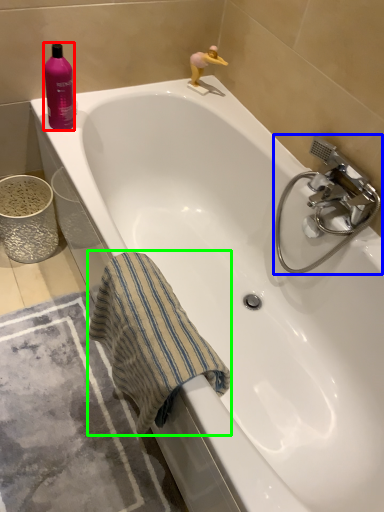
Question: Considering the real-world distances, which object is farthest from cleaning product (highlighted by a red box)? tap (highlighted by a blue box) or beach towel (highlighted by a green box)?

Choices:
 (A) tap
 (B) beach towel

Answer: (A)